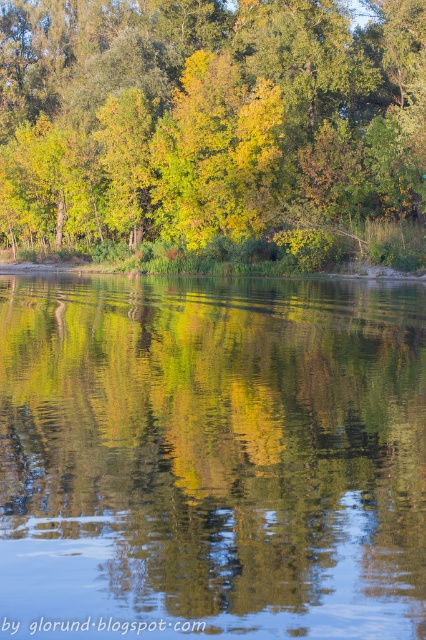
Question: Is transparent water at center above green leafy tree at upper center?

Choices:
 (A) yes
 (B) no

Answer: (B)

Question: Does transparent water at center appear on the left side of green leafy tree at upper center?

Choices:
 (A) yes
 (B) no

Answer: (B)

Question: Which point appears farthest from the camera in this image?

Choices:
 (A) (247, 312)
 (B) (115, 188)

Answer: (B)

Question: Among these points, which one is farthest from the camera?

Choices:
 (A) click(x=104, y=72)
 (B) click(x=187, y=488)

Answer: (A)

Question: Does transparent water at center come in front of green leafy tree at upper center?

Choices:
 (A) yes
 (B) no

Answer: (A)